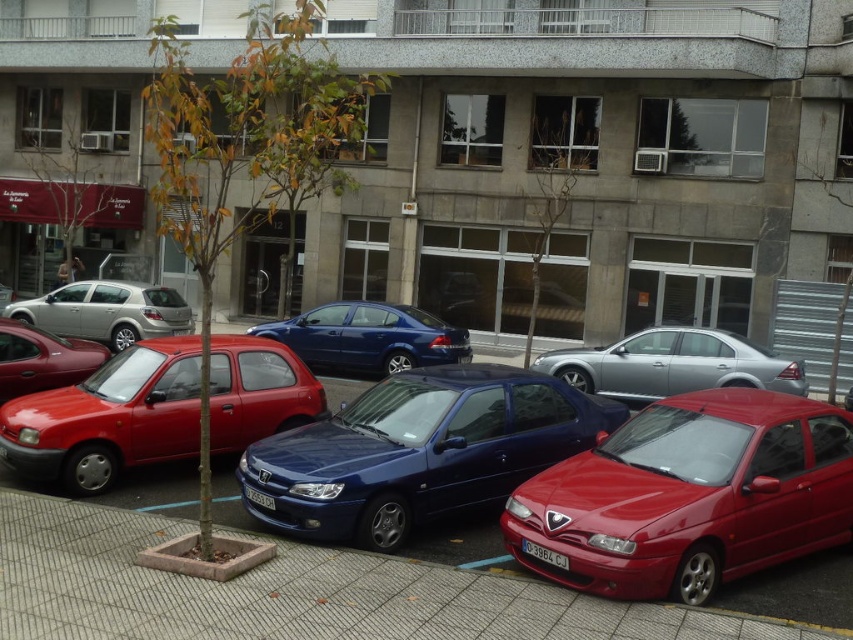
Question: Can you confirm if silver metallic sedan at center is positioned above glossy blue sedan at center?

Choices:
 (A) no
 (B) yes

Answer: (A)

Question: Which point is closer to the camera?

Choices:
 (A) metallic blue car at center
 (B) matte red car at center
 (C) shiny red hatchback at left

Answer: (A)

Question: Which point is farther to the camera?

Choices:
 (A) [x=68, y=364]
 (B) [x=328, y=356]
 (C) [x=566, y=561]
 (D) [x=305, y=428]

Answer: (B)

Question: Is metallic blue car at center wider than shiny red hatchback at left?

Choices:
 (A) yes
 (B) no

Answer: (A)

Question: Can you confirm if glossy red car at lower right is positioned to the left of matte red car at center?

Choices:
 (A) yes
 (B) no

Answer: (B)

Question: Among these objects, which one is nearest to the camera?

Choices:
 (A) matte red car at center
 (B) black plastic license plate at lower center
 (C) metallic blue car at center
 (D) glossy blue sedan at center

Answer: (C)